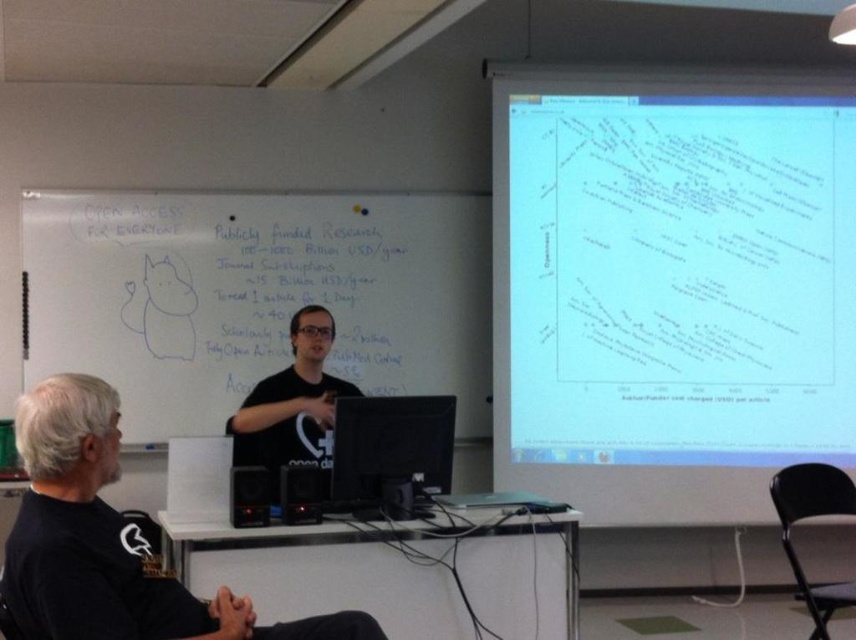
Question: Which object is closer to the camera taking this photo?

Choices:
 (A) white matte projector screen at upper right
 (B) whiteboard at upper left

Answer: (B)

Question: Which of the following is the farthest from the observer?

Choices:
 (A) whiteboard at upper left
 (B) black t-shirt at center
 (C) black plastic monitor at center
 (D) white matte projector screen at upper right

Answer: (D)

Question: Which point is closer to the camera?

Choices:
 (A) (538, 349)
 (B) (354, 408)
 (C) (290, 428)
 (D) (187, 205)

Answer: (B)

Question: Is white matte projector screen at upper right smaller than whiteboard at upper left?

Choices:
 (A) yes
 (B) no

Answer: (A)

Question: Does white matte projector screen at upper right appear under black plastic monitor at center?

Choices:
 (A) no
 (B) yes

Answer: (A)

Question: Can you confirm if black plastic monitor at center is thinner than black matte shirt at center?

Choices:
 (A) yes
 (B) no

Answer: (A)